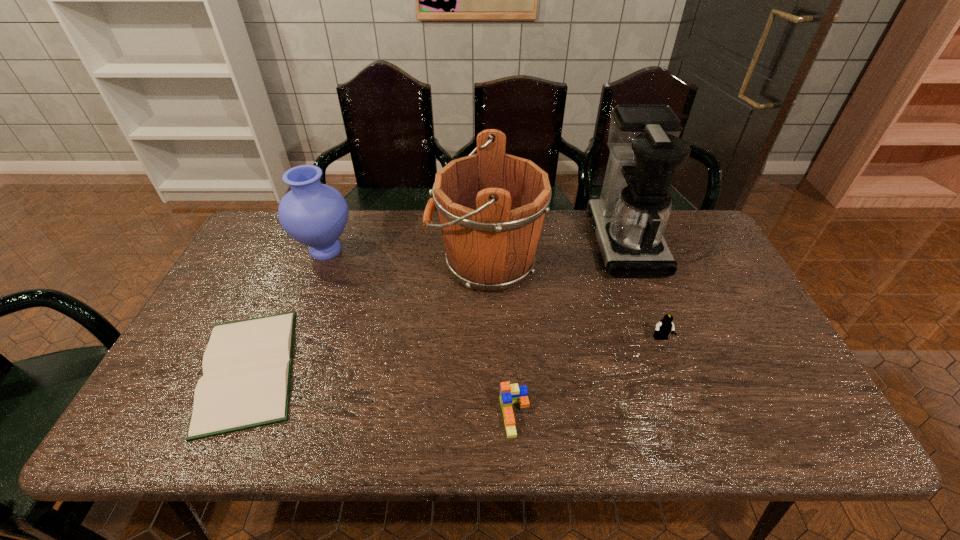
Where is `vase that is at the far edge`? This screenshot has width=960, height=540. vase that is at the far edge is located at coordinates (314, 214).

Find the location of a particular element. Lego that is positioned at the near edge is located at coordinates (509, 393).

The height and width of the screenshot is (540, 960). Find the location of `hardback book that is at the near edge`. hardback book that is at the near edge is located at coordinates (245, 383).

You are a GUI agent. You are given a task and a screenshot of the screen. Output one action in this format:
    pyautogui.click(x=<x>, y=<y>)
    Task: Click on the object that is at the left edge
    Image resolution: width=960 pixels, height=540 pixels.
    Given the screenshot: What is the action you would take?
    pyautogui.click(x=245, y=383)

Locate an element on the screen. Image resolution: width=960 pixels, height=540 pixels. object at the near left corner is located at coordinates 245,383.

Find the location of a particular element. The height and width of the screenshot is (540, 960). free space at the far edge is located at coordinates (348, 247).

This screenshot has width=960, height=540. Identify the location of vacant area at the near edge of the desktop. (504, 442).

The image size is (960, 540). I want to click on free space at the left edge of the desktop, so point(235,319).

In the image, there is a desktop. Where is `free region at the right edge`? free region at the right edge is located at coordinates (775, 352).

Locate an element on the screen. This screenshot has width=960, height=540. vacant area at the near left corner of the desktop is located at coordinates (201, 443).